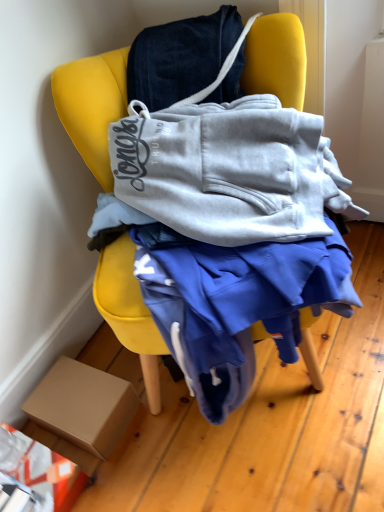
Question: Does brown cardboard box at lower left have a lesser height compared to yellow fabric chair at center?

Choices:
 (A) yes
 (B) no

Answer: (A)

Question: Does brown cardboard box at lower left touch yellow fabric chair at center?

Choices:
 (A) no
 (B) yes

Answer: (A)

Question: Does brown cardboard box at lower left have a smaller size compared to yellow fabric chair at center?

Choices:
 (A) no
 (B) yes

Answer: (B)

Question: Is brown cardboard box at lower left far away from yellow fabric chair at center?

Choices:
 (A) yes
 (B) no

Answer: (B)

Question: Is brown cardboard box at lower left thinner than yellow fabric chair at center?

Choices:
 (A) no
 (B) yes

Answer: (B)

Question: Does brown cardboard box at lower left have a larger size compared to yellow fabric chair at center?

Choices:
 (A) no
 (B) yes

Answer: (A)

Question: Is yellow fabric chair at center smaller than brown cardboard box at lower left?

Choices:
 (A) yes
 (B) no

Answer: (B)

Question: Is yellow fabric chair at center in contact with brown cardboard box at lower left?

Choices:
 (A) yes
 (B) no

Answer: (B)

Question: Does yellow fabric chair at center come in front of brown cardboard box at lower left?

Choices:
 (A) yes
 (B) no

Answer: (A)

Question: Considering the relative sizes of yellow fabric chair at center and brown cardboard box at lower left in the image provided, is yellow fabric chair at center bigger than brown cardboard box at lower left?

Choices:
 (A) yes
 (B) no

Answer: (A)

Question: Can you confirm if yellow fabric chair at center is shorter than brown cardboard box at lower left?

Choices:
 (A) yes
 (B) no

Answer: (B)

Question: Could you tell me if yellow fabric chair at center is facing brown cardboard box at lower left?

Choices:
 (A) yes
 (B) no

Answer: (B)

Question: Is yellow fabric chair at center bigger or smaller than brown cardboard box at lower left?

Choices:
 (A) big
 (B) small

Answer: (A)